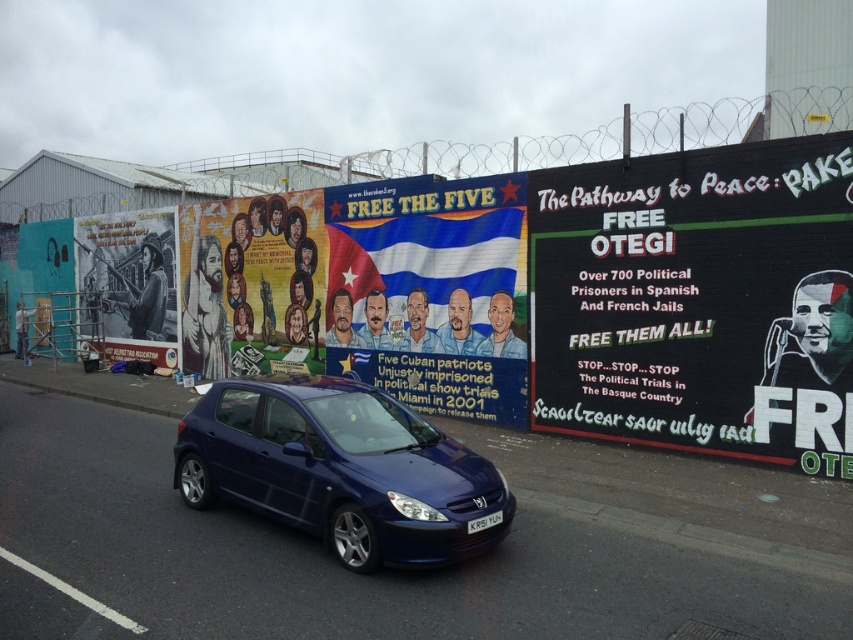
Can you confirm if black matte billboard at right is positioned above blue fabric poster at center?

No, black matte billboard at right is not above blue fabric poster at center.

Is point (596, 323) in front of point (381, 221)?

Yes.

The width and height of the screenshot is (853, 640). Identify the location of black matte billboard at right. (698, 300).

I want to click on black matte billboard at right, so click(698, 300).

Who is taller, matte blue hatchback at center or matte paper poster at center?

matte paper poster at center

Is matte blue hatchback at center to the right of matte paper poster at center from the viewer's perspective?

Indeed, matte blue hatchback at center is positioned on the right side of matte paper poster at center.

You are a GUI agent. You are given a task and a screenshot of the screen. Output one action in this format:
    pyautogui.click(x=<x>, y=<y>)
    Task: Click on the matte blue hatchback at center
    
    Given the screenshot: What is the action you would take?
    pyautogui.click(x=341, y=468)

Image resolution: width=853 pixels, height=640 pixels. I want to click on matte blue hatchback at center, so click(341, 468).

Is blue fabric poster at center further to camera compared to black glossy poster at left?

No.

Who is lower down, blue fabric poster at center or black glossy poster at left?

blue fabric poster at center is lower down.

This screenshot has width=853, height=640. I want to click on blue fabric poster at center, so click(x=431, y=292).